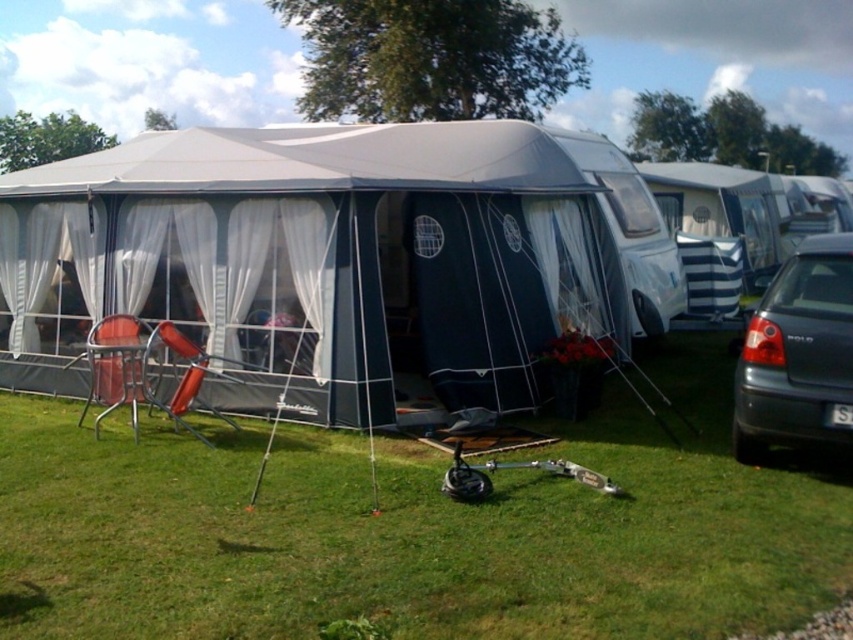
You are planning to set up a new tent at point (321, 259). Is there already an object at that location?

Yes, the matte gray tent at center is located at point (321, 259).

You are standing at the point marked by the coordinates (415, 529) in the image. Looking around, you see the large grey and black tent with a canopy, a scooter, and a parked car. Which object is closest to your current position?

The point marked by the coordinates (415, 529) is located at the green grass at lower center, which is closest to the scooter lying on the grass in front of the tent.

You are standing at the point marked as point [415,529] in the image. What is the closest object to you in the scene?

The closest object to you at point [415,529] is the green grass at lower center, as it is located exactly at that point.